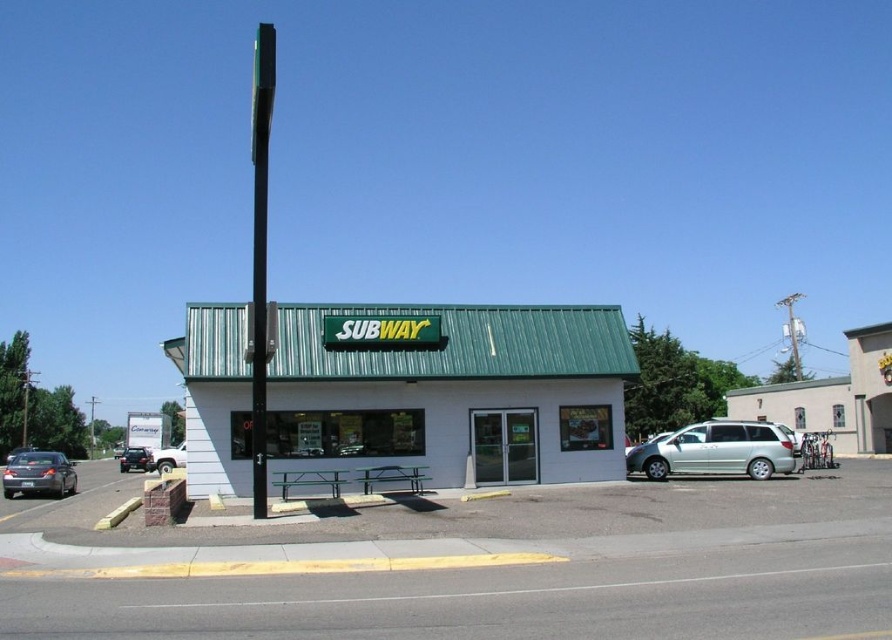
Does point (477, 324) lie behind point (752, 465)?

No.

Can you confirm if white matte building at center is positioned below silver metallic minivan at lower right?

No, white matte building at center is not below silver metallic minivan at lower right.

Is point (312, 349) farther from camera compared to point (651, 449)?

No, it is not.

At what (x,y) coordinates should I click in order to perform the action: click on white matte building at center. Please return your answer as a coordinate pair (x, y). This screenshot has height=640, width=892. Looking at the image, I should click on coord(451,392).

Who is more forward, (707,458) or (139,467)?

Positioned in front is point (707,458).

Is silver metallic minivan at lower right further to camera compared to shiny black sedan at left?

No, silver metallic minivan at lower right is closer to the viewer.

Is point (750, 456) positioned behind point (121, 472)?

No, (750, 456) is in front of (121, 472).

The image size is (892, 640). I want to click on silver metallic minivan at lower right, so click(715, 451).

Can you confirm if matte black sedan at lower left is positioned to the left of green metallic pole at left?

No, matte black sedan at lower left is not to the left of green metallic pole at left.

Does matte black sedan at lower left have a greater width compared to green metallic pole at left?

No.

Who is more distant from viewer, (39, 451) or (21, 420)?

Point (21, 420)

Find the location of `matte black sedan at lower left`. matte black sedan at lower left is located at coordinates (39, 474).